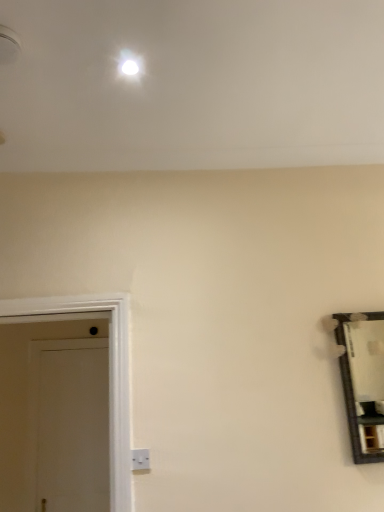
The height and width of the screenshot is (512, 384). I want to click on white plastic electric outlet at lower center, so click(x=140, y=459).

Describe the element at coordinates (140, 459) in the screenshot. I see `white plastic electric outlet at lower center` at that location.

Measure the distance between point (x=141, y=464) and camera.

1.89 meters.

I want to click on white matte door at left, so click(73, 430).

The image size is (384, 512). Describe the element at coordinates (73, 430) in the screenshot. I see `white matte door at left` at that location.

Identify the location of white plastic electric outlet at lower center. Image resolution: width=384 pixels, height=512 pixels. (140, 459).

Which object is positioned more to the left, white matte door at left or white plastic electric outlet at lower center?

From the viewer's perspective, white matte door at left appears more on the left side.

Which object is more forward, white matte door at left or white plastic electric outlet at lower center?

white plastic electric outlet at lower center.

Between point (57, 485) and point (147, 454), which one is positioned behind?

Point (57, 485)

Consider the image. From the image's perspective, would you say white matte door at left is shown under white plastic electric outlet at lower center?

Yes, from the image's perspective, white matte door at left is below white plastic electric outlet at lower center.

From a real-world perspective, is white matte door at left located beneath white plastic electric outlet at lower center?

Actually, white matte door at left is physically above white plastic electric outlet at lower center in the real world.

Considering the relative sizes of white matte door at left and white plastic electric outlet at lower center in the image provided, is white matte door at left wider than white plastic electric outlet at lower center?

Indeed, white matte door at left has a greater width compared to white plastic electric outlet at lower center.

Does white matte door at left have a lesser height compared to white plastic electric outlet at lower center?

In fact, white matte door at left may be taller than white plastic electric outlet at lower center.

Which of these two, white matte door at left or white plastic electric outlet at lower center, is smaller?

Smaller between the two is white plastic electric outlet at lower center.

Is white matte door at left surrounding white plastic electric outlet at lower center?

No, white matte door at left does not contain white plastic electric outlet at lower center.

Is white matte door at left far from white plastic electric outlet at lower center?

white matte door at left is positioned a significant distance from white plastic electric outlet at lower center.

Is white matte door at left looking in the opposite direction of white plastic electric outlet at lower center?

That's not correct — white matte door at left is not looking away from white plastic electric outlet at lower center.

What's the angular difference between white matte door at left and white plastic electric outlet at lower center's facing directions?

There is a 0.0182-degree angle between the facing directions of white matte door at left and white plastic electric outlet at lower center.

Measure the distance between white matte door at left and white plastic electric outlet at lower center.

The distance of white matte door at left from white plastic electric outlet at lower center is 1.73 meters.

You are a GUI agent. You are given a task and a screenshot of the screen. Output one action in this format:
    pyautogui.click(x=<x>, y=<y>)
    Task: Click on the door lying below the white plastic electric outlet at lower center (from the image's perspective)
    
    Given the screenshot: What is the action you would take?
    pyautogui.click(x=73, y=430)

Does white plastic electric outlet at lower center appear on the left side of white matte door at left?

Incorrect, white plastic electric outlet at lower center is not on the left side of white matte door at left.

Does white plastic electric outlet at lower center come in front of white matte door at left?

Yes, white plastic electric outlet at lower center is in front of white matte door at left.

Between point (131, 453) and point (60, 376), which one is positioned in front?

The point (131, 453) is closer to the camera.

From the image's perspective, is white plastic electric outlet at lower center located above white matte door at left?

Yes, from the image's perspective, white plastic electric outlet at lower center is over white matte door at left.

From a real-world perspective, relative to white matte door at left, is white plastic electric outlet at lower center vertically above or below?

Clearly, from a real-world perspective, white plastic electric outlet at lower center is below white matte door at left.

Which object is wider, white plastic electric outlet at lower center or white matte door at left?

Wider between the two is white matte door at left.

Who is shorter, white plastic electric outlet at lower center or white matte door at left?

Standing shorter between the two is white plastic electric outlet at lower center.

Looking at this image, based on their sizes in the image, would you say white plastic electric outlet at lower center is bigger or smaller than white matte door at left?

Considering their sizes, white plastic electric outlet at lower center takes up less space than white matte door at left.

Would you say white plastic electric outlet at lower center contains white matte door at left?

That's incorrect, white matte door at left is not inside white plastic electric outlet at lower center.

From the picture: Is white plastic electric outlet at lower center not close to white matte door at left?

Yes, white plastic electric outlet at lower center is far from white matte door at left.

Is white plastic electric outlet at lower center oriented towards white matte door at left?

No.

Image resolution: width=384 pixels, height=512 pixels. In order to click on door on the left of white plastic electric outlet at lower center in this screenshot , I will do `click(73, 430)`.

Find the location of a particular element. This screenshot has width=384, height=512. door above the white plastic electric outlet at lower center (from a real-world perspective) is located at coordinates (73, 430).

Where is `door that is on the left side of white plastic electric outlet at lower center`? door that is on the left side of white plastic electric outlet at lower center is located at coordinates (73, 430).